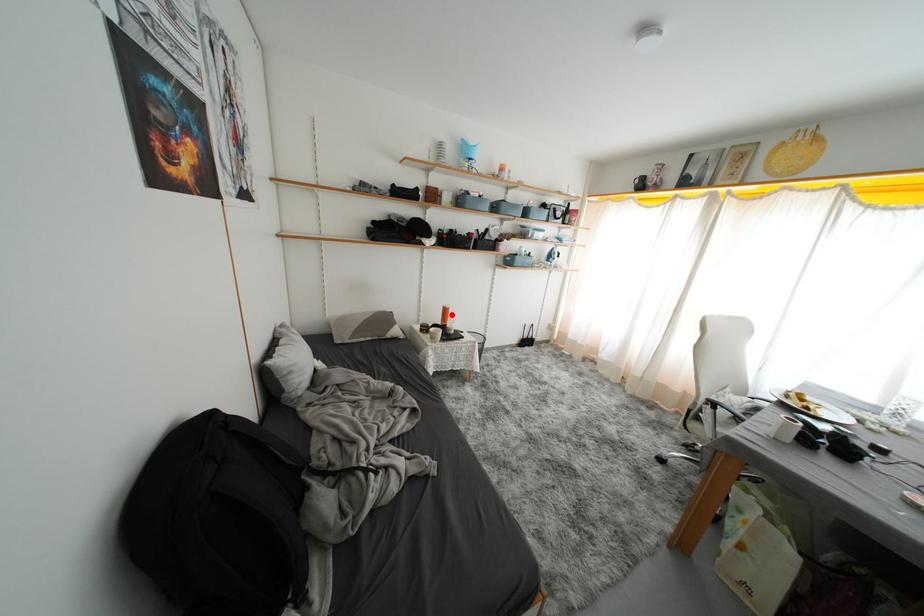
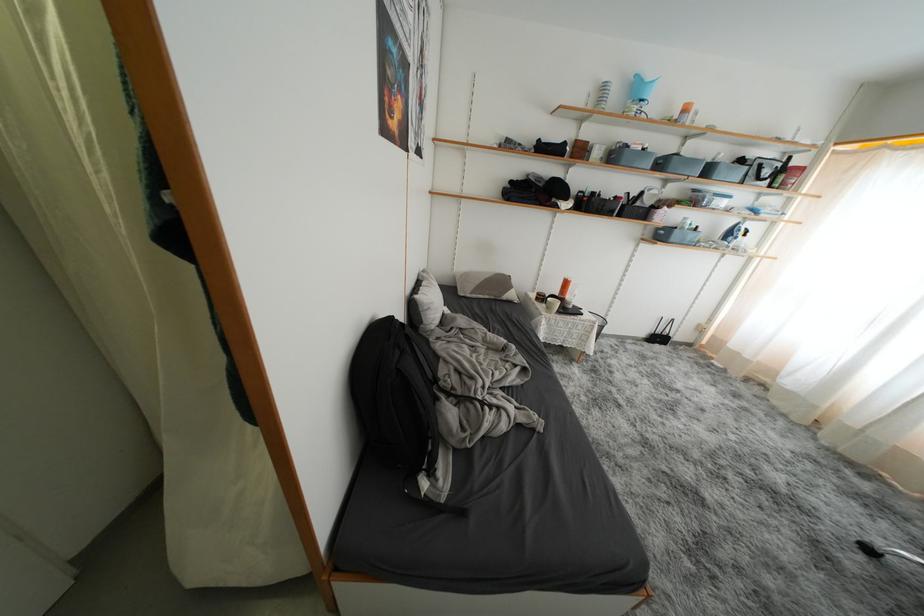
Locate, in the second image, the point that corresponds to the highlighted location in the first image.

(572, 286)